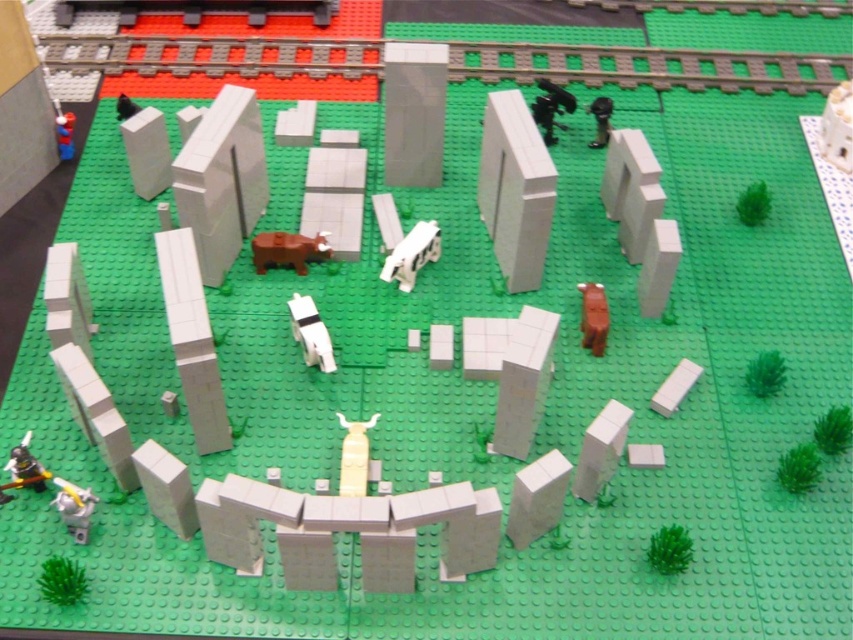
Question: From the image, what is the correct spatial relationship of green matte brick at lower right in relation to smooth plastic superman at upper left?

Choices:
 (A) below
 (B) above

Answer: (A)

Question: Does white plastic cow at center come in front of metallic silver gear at lower left?

Choices:
 (A) yes
 (B) no

Answer: (B)

Question: Is white plastic cat at upper right thinner than metallic silver gear at lower left?

Choices:
 (A) no
 (B) yes

Answer: (B)

Question: Among these objects, which one is farthest from the camera?

Choices:
 (A) smooth plastic superman at upper left
 (B) black plastic cow at upper right
 (C) brown matte horse at center

Answer: (B)

Question: Which point is closer to the camera taking this photo?

Choices:
 (A) (531, 104)
 (B) (412, 240)

Answer: (B)

Question: Which object appears closest to the camera in this image?

Choices:
 (A) brown matte cow at center
 (B) metallic silver gear at lower left

Answer: (B)